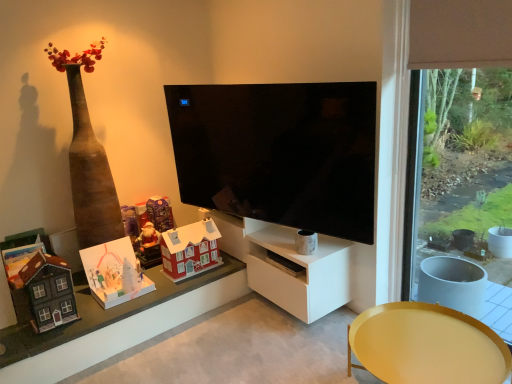
I want to click on free space in front of matte red house at center, acting as the third toy starting from the back, so click(x=184, y=281).